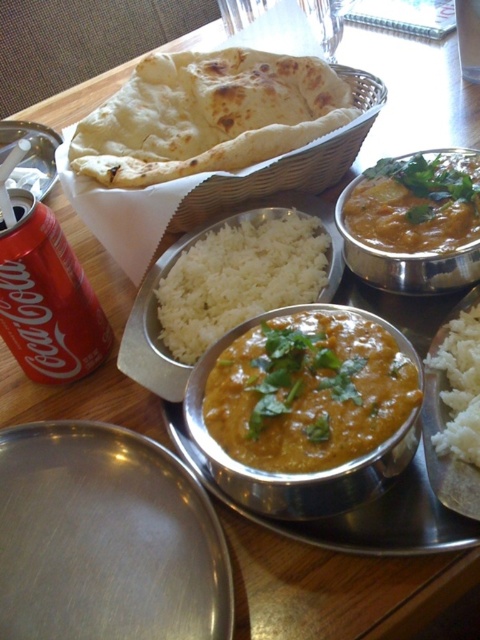
You are a photographer trying to capture the meal setup on the wooden table. You notice two points of interest marked as point (308, 458) and point (324, 269). Which point should you focus on first if you want to ensure the closest object is in sharp focus?

Point (308, 458) is closer to the camera than point (324, 269), so you should focus on point (308, 458) first to ensure the closest object is in sharp focus.